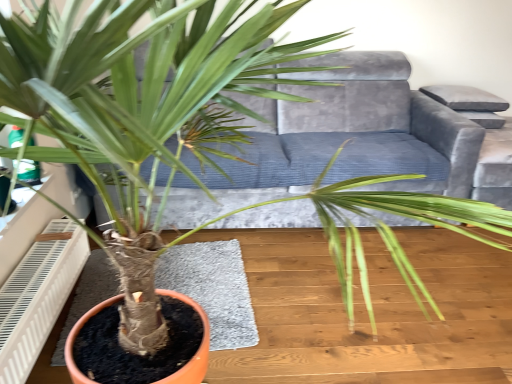
Question: Is velvet grey armchair at upper right located within velvet grey couch at center?

Choices:
 (A) yes
 (B) no

Answer: (B)

Question: Is velvet grey couch at center closer to camera compared to velvet grey armchair at upper right?

Choices:
 (A) yes
 (B) no

Answer: (A)

Question: From the image's perspective, does velvet grey couch at center appear higher than velvet grey armchair at upper right?

Choices:
 (A) yes
 (B) no

Answer: (A)

Question: Is velvet grey couch at center taller than velvet grey armchair at upper right?

Choices:
 (A) no
 (B) yes

Answer: (B)

Question: Is velvet grey couch at center positioned far away from velvet grey armchair at upper right?

Choices:
 (A) no
 (B) yes

Answer: (A)

Question: Is velvet grey couch at center looking in the opposite direction of velvet grey armchair at upper right?

Choices:
 (A) yes
 (B) no

Answer: (B)

Question: Does white plastic air conditioner at lower left have a smaller size compared to velvet grey armchair at upper right?

Choices:
 (A) yes
 (B) no

Answer: (A)

Question: Does white plastic air conditioner at lower left have a greater height compared to velvet grey armchair at upper right?

Choices:
 (A) yes
 (B) no

Answer: (B)

Question: Would you say white plastic air conditioner at lower left is a long distance from velvet grey armchair at upper right?

Choices:
 (A) no
 (B) yes

Answer: (B)

Question: From the image's perspective, is white plastic air conditioner at lower left above velvet grey armchair at upper right?

Choices:
 (A) yes
 (B) no

Answer: (B)

Question: Is white plastic air conditioner at lower left touching velvet grey armchair at upper right?

Choices:
 (A) no
 (B) yes

Answer: (A)

Question: Can we say white plastic air conditioner at lower left lies outside velvet grey armchair at upper right?

Choices:
 (A) yes
 (B) no

Answer: (A)

Question: Could you tell me if velvet grey armchair at upper right is facing velvet grey couch at center?

Choices:
 (A) yes
 (B) no

Answer: (B)